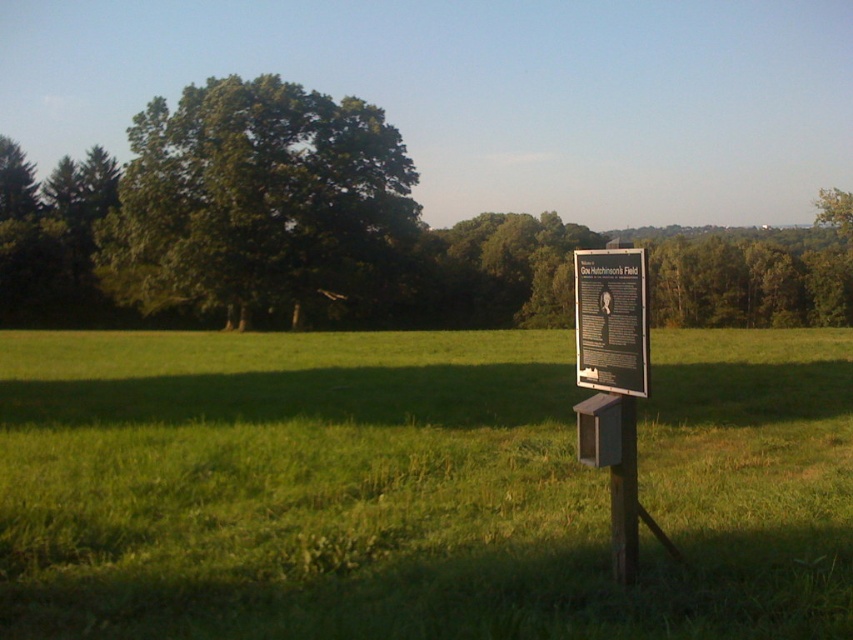
You are a hiker who wants to read both the matte black sign at center and the wooden sign at center. Which sign should you approach first to read the one that is closer to you?

You should approach the matte black sign at center first because it is closer to you than the wooden sign at center.

You are a hiker who wants to read the matte black sign at center. However, there is a green leafy tree at center blocking your view. Can you see the sign clearly from where you are standing?

The green leafy tree at center is positioned over the matte black sign at center, so the tree is blocking the sign, making it difficult to see clearly.